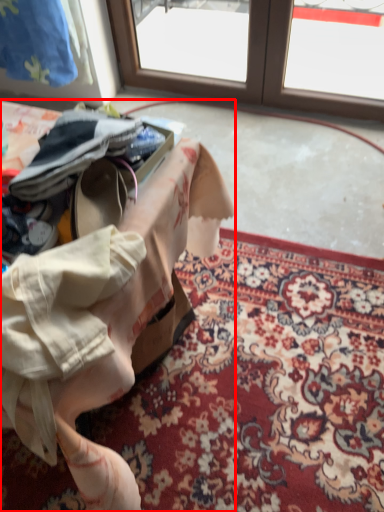
Question: In this image, where is table (annotated by the red box) located relative to mat?

Choices:
 (A) right
 (B) left

Answer: (B)